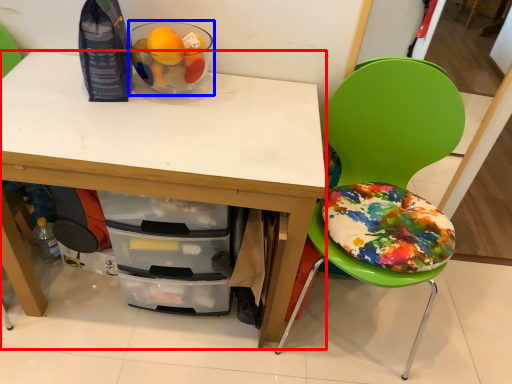
Question: Which object appears farthest to the camera in this image, desk (highlighted by a red box) or glass bowl (highlighted by a blue box)?

Choices:
 (A) desk
 (B) glass bowl

Answer: (B)